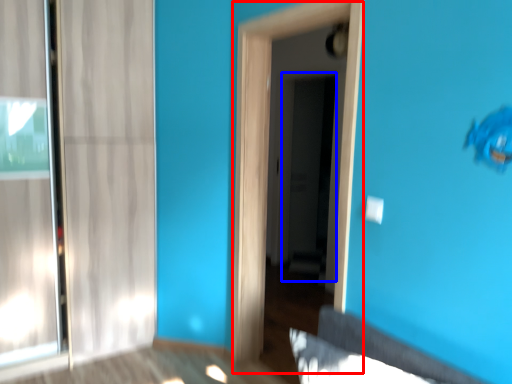
Question: Among these objects, which one is farthest to the camera, screen door (highlighted by a red box) or screen door (highlighted by a blue box)?

Choices:
 (A) screen door
 (B) screen door

Answer: (B)